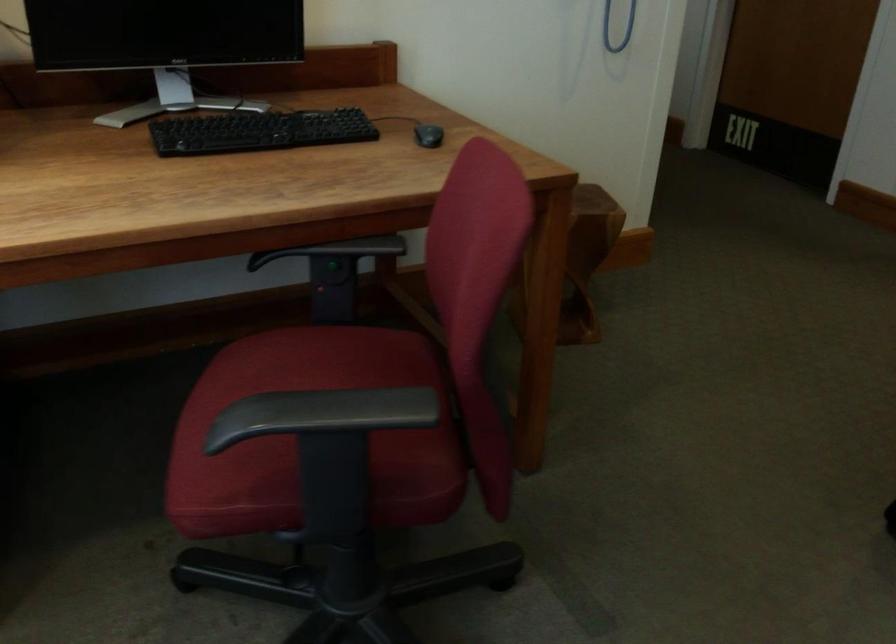
Locate an element on the screen. This screenshot has width=896, height=644. red chair sitting surface is located at coordinates (309, 433).